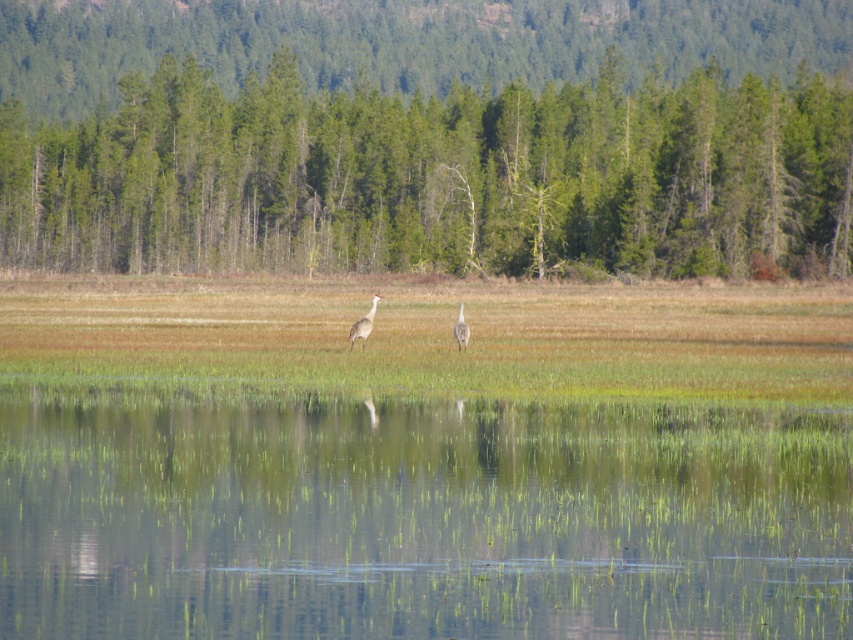
Question: Estimate the real-world distances between objects in this image. Which object is farther from the gray feathered bird at center?

Choices:
 (A) white feathered bird at center
 (B) green matte trees at center

Answer: (B)

Question: Is clear water at center thinner than gray feathered bird at center?

Choices:
 (A) no
 (B) yes

Answer: (A)

Question: Which of the following is the closest to the observer?

Choices:
 (A) (463, 324)
 (B) (398, 470)
 (C) (376, 296)
 (D) (817, 10)

Answer: (B)

Question: Is clear water at center wider than gray feathered bird at center?

Choices:
 (A) yes
 (B) no

Answer: (A)

Question: Can you confirm if clear water at center is positioned below white feathered bird at center?

Choices:
 (A) yes
 (B) no

Answer: (A)

Question: Which object is the closest to the white feathered bird at center?

Choices:
 (A) gray feathered bird at center
 (B) clear water at center
 (C) green matte trees at center

Answer: (A)